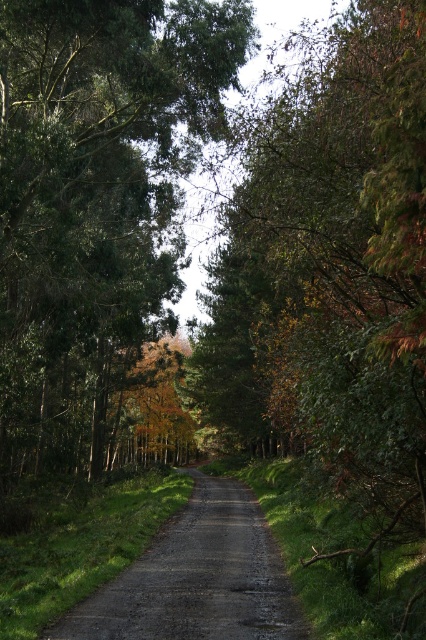
Locate an element on the screen. green matte tree at center is located at coordinates (94, 200).

Is point (5, 362) closer to viewer compared to point (265, 556)?

No.

This screenshot has height=640, width=426. I want to click on green matte tree at center, so click(x=94, y=200).